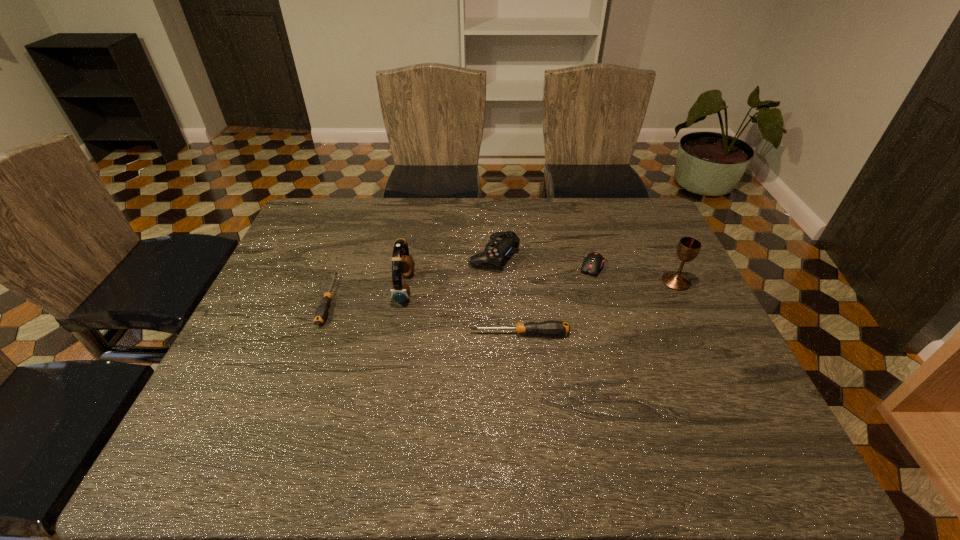
Locate an element on the screen. Image resolution: width=960 pixels, height=540 pixels. vacant space that is in between the fifth object from right to left and the shortest object is located at coordinates (367, 294).

Locate an element on the screen. free space between the second object from right to left and the control is located at coordinates (542, 261).

The width and height of the screenshot is (960, 540). Identify the location of empty space between the chalice and the shortest object. (502, 291).

The height and width of the screenshot is (540, 960). Identify the location of blank region between the fifth object from left to right and the taller screwdriver. (556, 300).

Where is `free space between the headset and the second object from right to left`? This screenshot has height=540, width=960. free space between the headset and the second object from right to left is located at coordinates (498, 278).

The width and height of the screenshot is (960, 540). In order to click on vacant region between the chalice and the taller screwdriver in this screenshot , I will do `click(598, 308)`.

Where is `free area in between the headset and the third tallest object`? The height and width of the screenshot is (540, 960). free area in between the headset and the third tallest object is located at coordinates (449, 272).

I want to click on unoccupied area between the fourth shortest object and the leftmost object, so click(x=412, y=278).

Select which object appears as the second closest to the shortest object. Please provide its 2D coordinates. Your answer should be formatted as a tuple, i.e. [(x, y)], where the tuple contains the x and y coordinates of a point satisfying the conditions above.

[(501, 243)]

Where is `object that can be found as the fifth closest to the rightmost object`? The width and height of the screenshot is (960, 540). object that can be found as the fifth closest to the rightmost object is located at coordinates (321, 313).